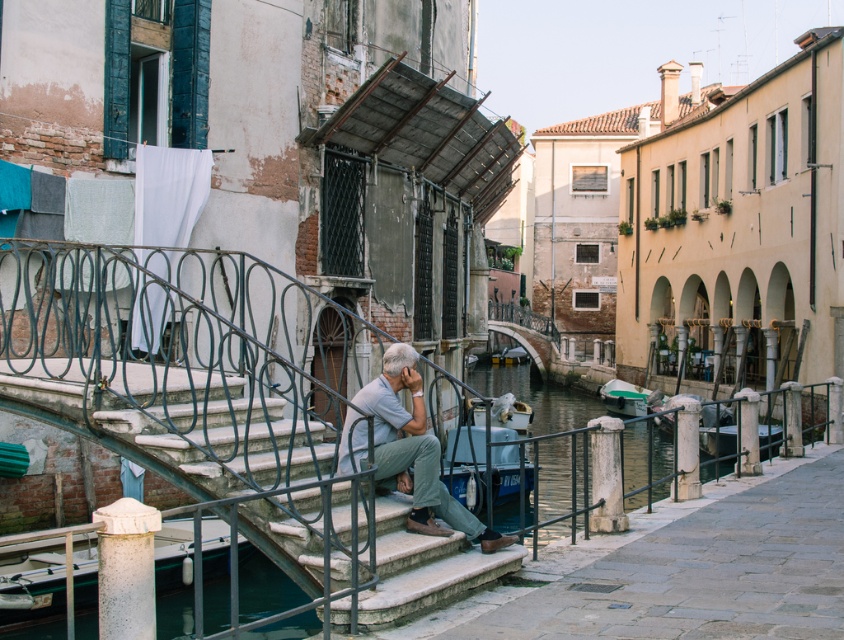
You are a tourist standing on the bridge and want to take a photo of the metallic gray railing at center and the smooth concrete stairs at center. Which object should you focus on first if you want to capture both in a single frame without moving the camera?

You should focus on the metallic gray railing at center first because it is bigger than the smooth concrete stairs at center, so it will occupy more space in the frame and ensure both are captured without needing to adjust the camera position.

You are standing at the base of the bridge steps and want to take a photo that includes both the man on the bridge and the distant buildings. Which of the two points, point (84, 602) or point (639, 392), is closer to you when framing the shot?

Point (84, 602) is closer to the viewer than point (639, 392), so it will appear nearer in your photo frame.

You are a tourist standing on the smooth concrete stairs at center. You want to take a photo of the light gray fabric pants at center. Which direction should you look to capture the pants in your camera?

The smooth concrete stairs at center is below the light gray fabric pants at center, so you should look upward to capture the pants in your camera.